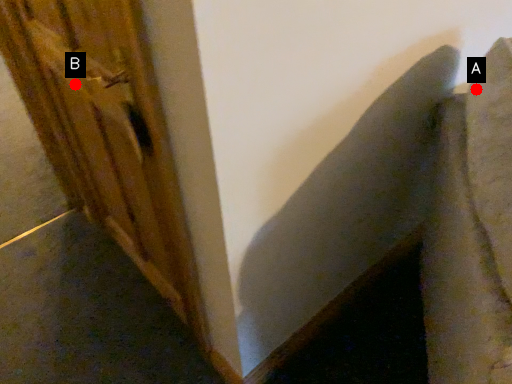
Question: Two points are circled on the image, labeled by A and B beside each circle. Which point is farther to the camera?

Choices:
 (A) A is further
 (B) B is further

Answer: (B)